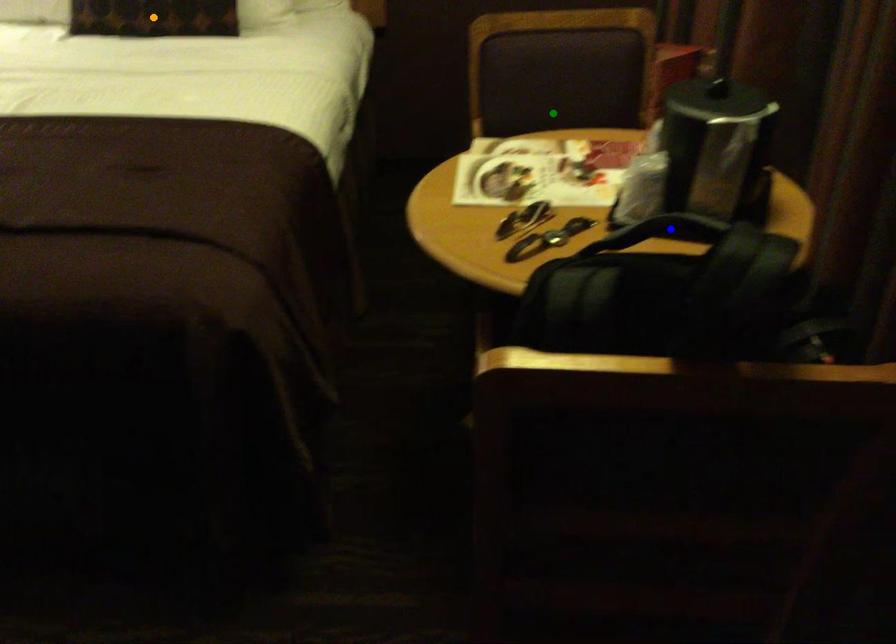
Order these from nearest to farthest:
blue point
orange point
green point

blue point < green point < orange point